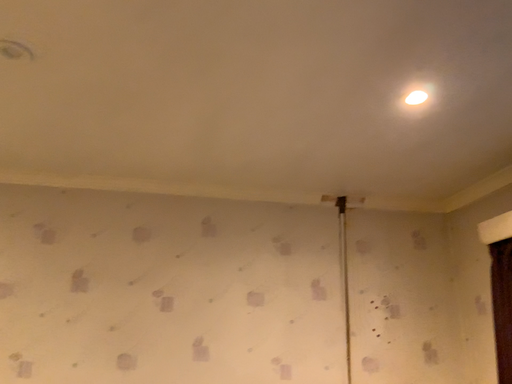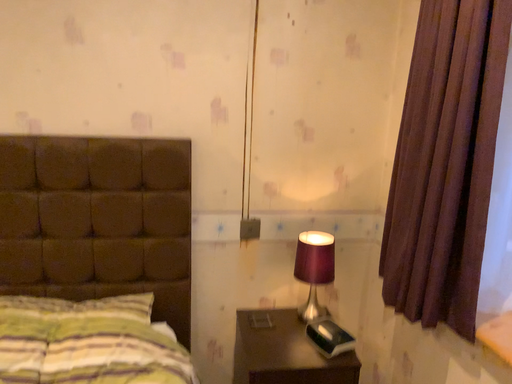
Question: How did the camera likely rotate when shooting the video?

Choices:
 (A) rotated downward
 (B) rotated upward

Answer: (A)